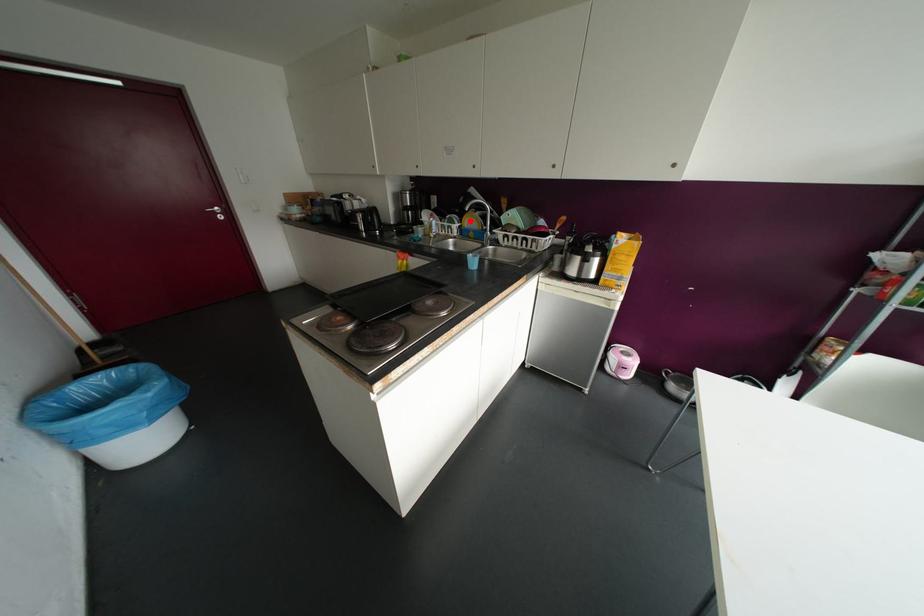
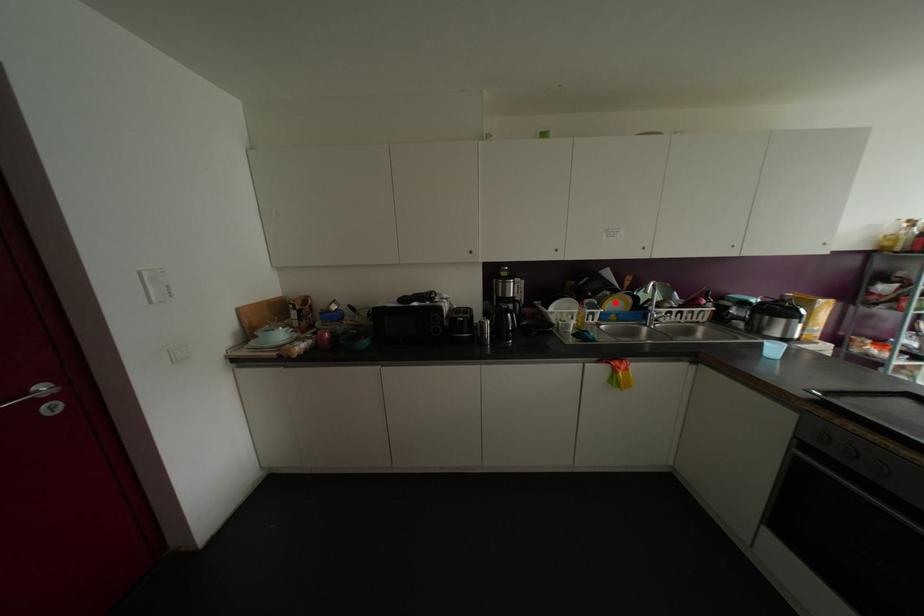
I am providing you with two images of the same scene from different viewpoints. A red point is marked on the first image and another point is marked on the second image. Does the point marked in image1 correspond to the same location as the one in image2?

Yes